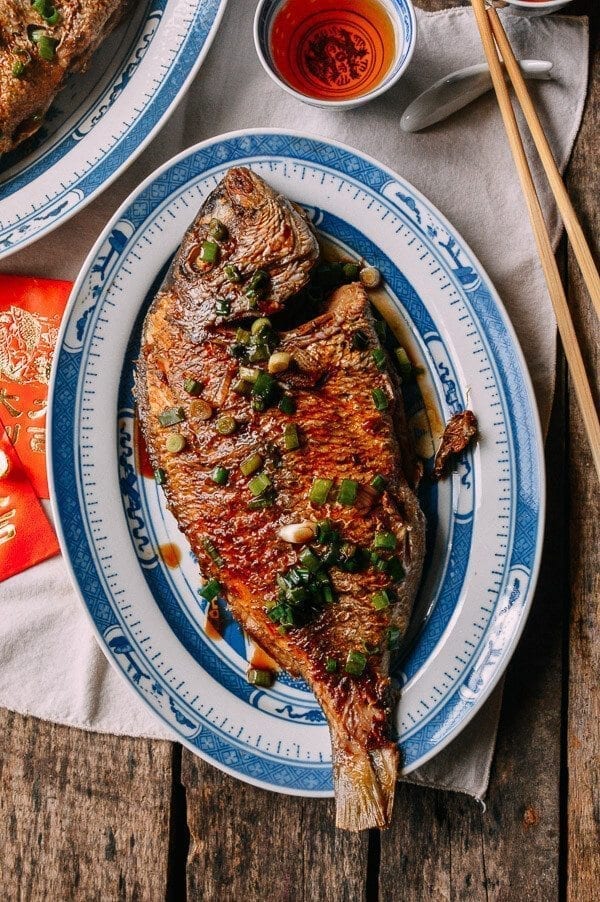
Where is `blue and white platter`? Image resolution: width=600 pixels, height=902 pixels. blue and white platter is located at coordinates (394, 223), (117, 96).